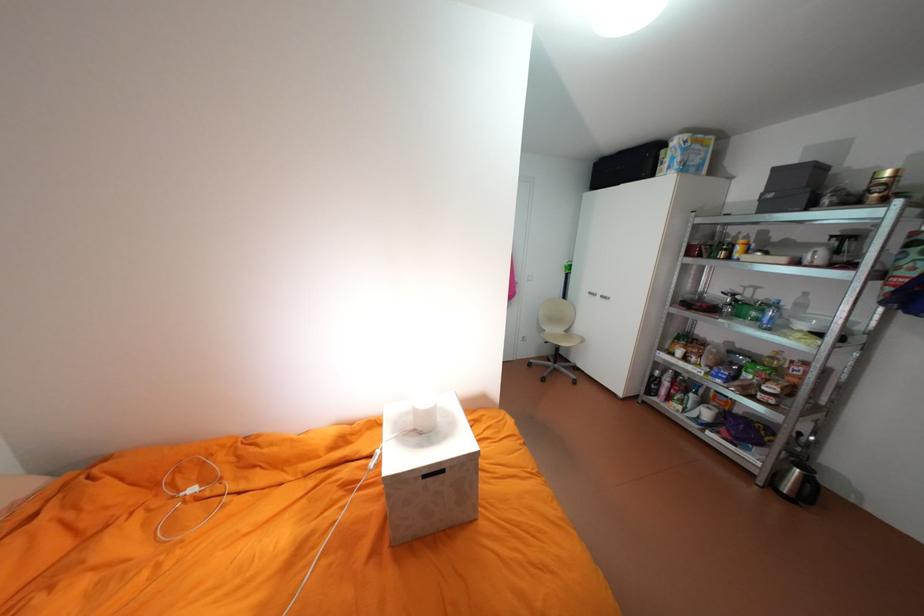
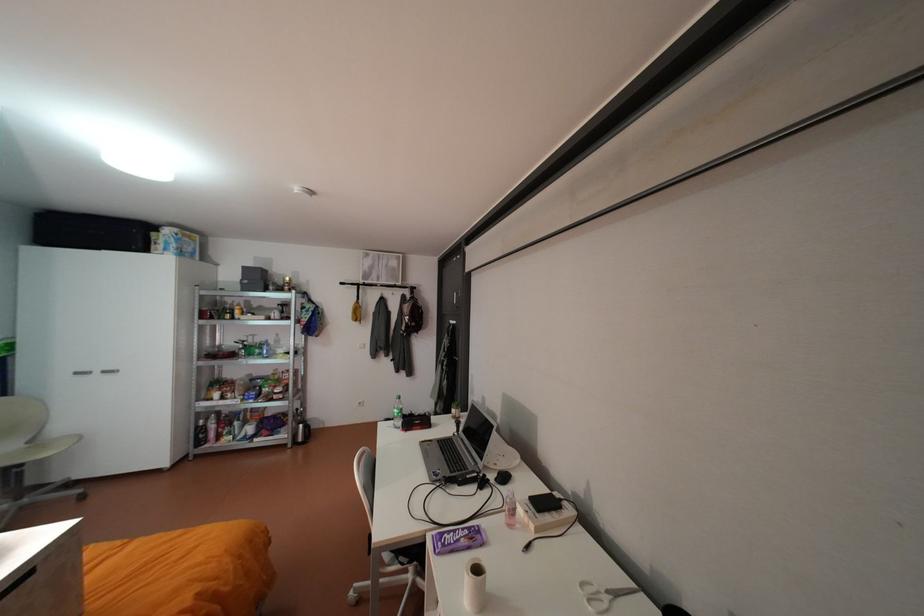
Question: The camera is either moving clockwise (left) or counter-clockwise (right) around the object. The first image is from the beginning of the video and the second image is from the end. Is the camera moving left or right when shooting the video?

Choices:
 (A) Left
 (B) Right

Answer: (A)